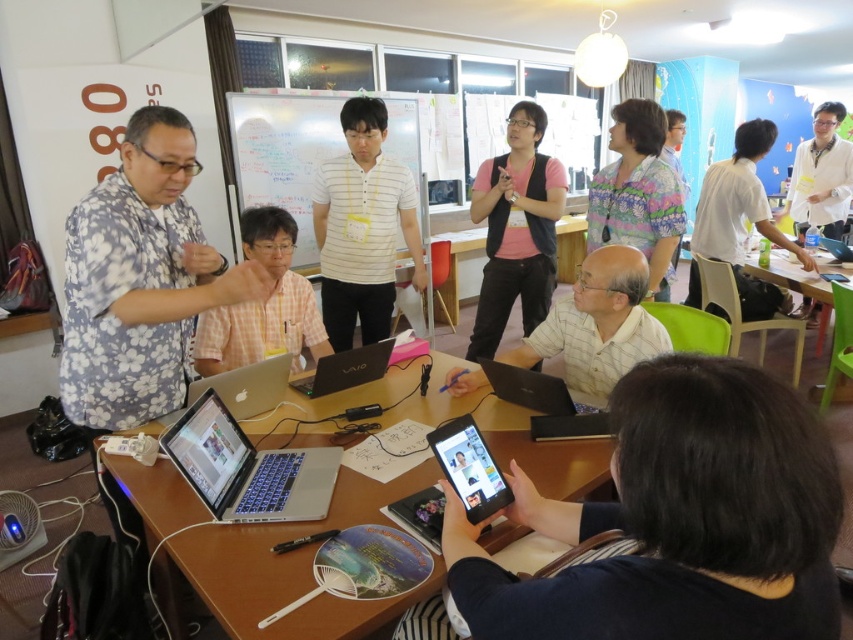
You are a photographer positioned behind the wooden table at center and want to take a photo of the matte yellow shirt at center without the table obstructing the view. Is this possible?

The matte yellow shirt at center is in front of the wooden table at center, so the photographer can take the photo without the table obstructing the view.

You are standing at the camera position in the room. There is a point at coordinate point (473, 474). Can you reach this point without moving your feet?

The distance between you and the point at coordinate point (473, 474) is 1.29 meters. Since you can typically reach about 0.5 meters from your body, you cannot reach the point without moving your feet.

You are a participant in the meeting and need to access both the matte black tablet at center and the glossy black laptop at center. Which device is closer to you if you are standing directly behind the table?

The matte black tablet at center is closer to you because it is positioned in front of the glossy black laptop at center, meaning the tablet is nearer to the back of the table where you are standing.